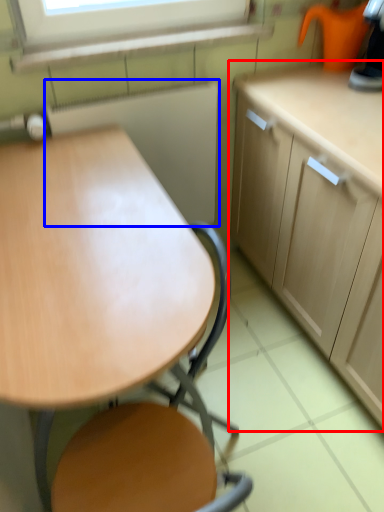
Question: Among these objects, which one is nearest to the camera, cabinetry (highlighted by a red box) or appliance (highlighted by a blue box)?

Choices:
 (A) cabinetry
 (B) appliance

Answer: (A)